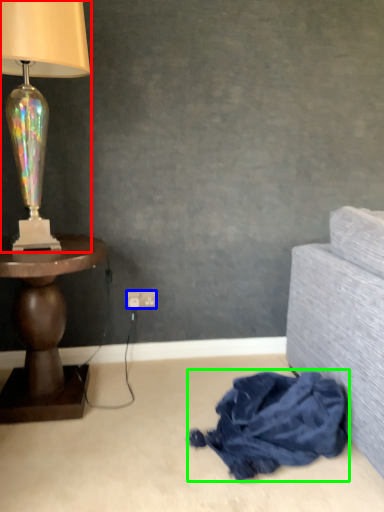
Question: Which is nearer to the lamp (highlighted by a red box)? power outlet (highlighted by a blue box) or material (highlighted by a green box).

Choices:
 (A) power outlet
 (B) material

Answer: (A)